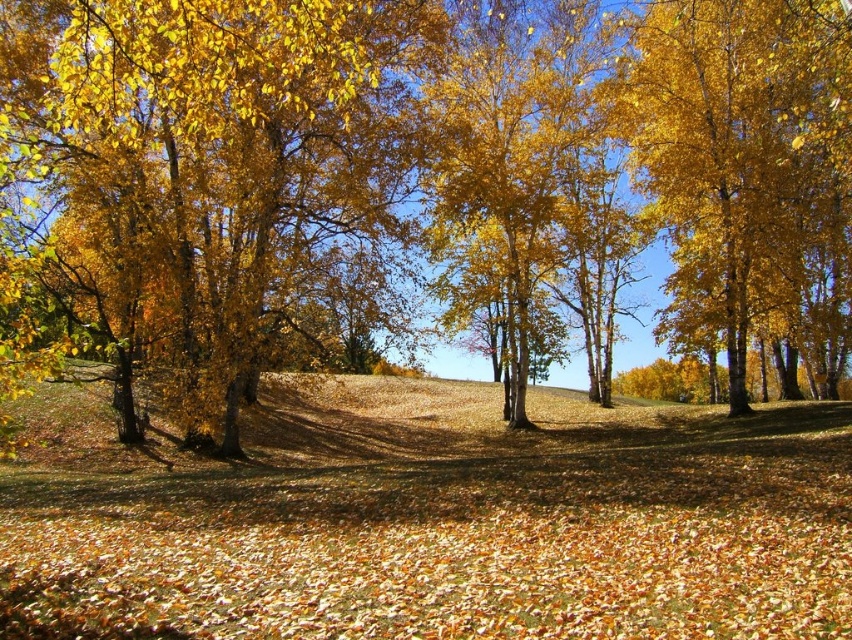
You are a bird flying over the golden textured tree at left and the golden smooth tree at right. Which tree would you need to fly higher to reach?

The golden textured tree at left is above the golden smooth tree at right, so you would need to fly higher to reach the golden textured tree at left.

You are planning to place a small bench in this autumnal grove. You want it to be near both the golden textured tree at left and the golden smooth tree at right without being too crowded. Considering their sizes, which tree would allow more space around it for the bench?

The golden smooth tree at right occupies more space than the golden textured tree at left, so placing the bench near the golden smooth tree at right would provide more space around it for the bench.

You are standing in the middle of the autumn grove and want to take a photo of both the golden textured tree at left and the golden smooth tree at right. Since you can only move forward or backward, which direction should you move to ensure both trees are fully in your camera frame?

You should move backward to ensure both the golden textured tree at left and the golden smooth tree at right are fully in your camera frame since the golden textured tree at left is positioned on the left side of the golden smooth tree at right, meaning they are close to each other. Moving backward will widen your field of view, allowing both trees to fit in the frame.